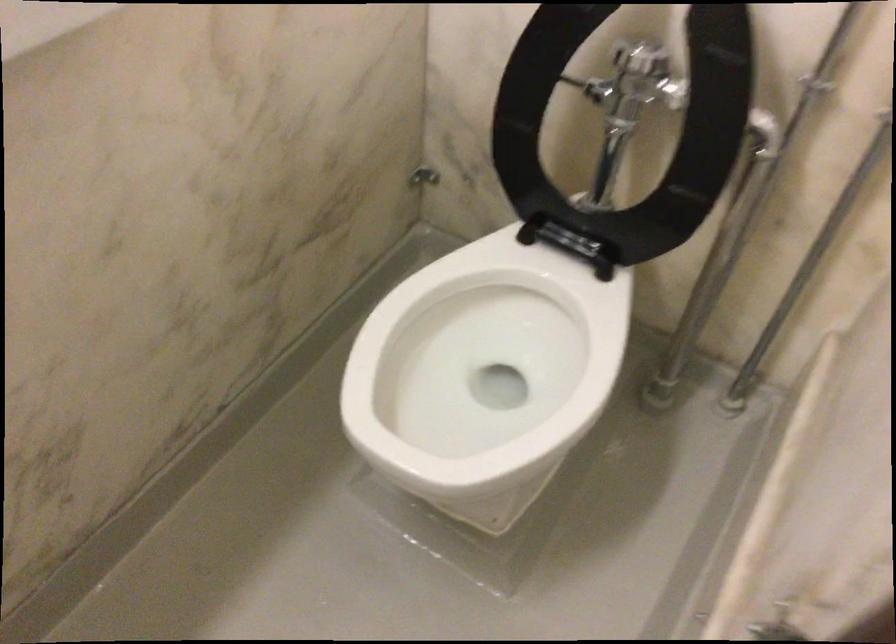
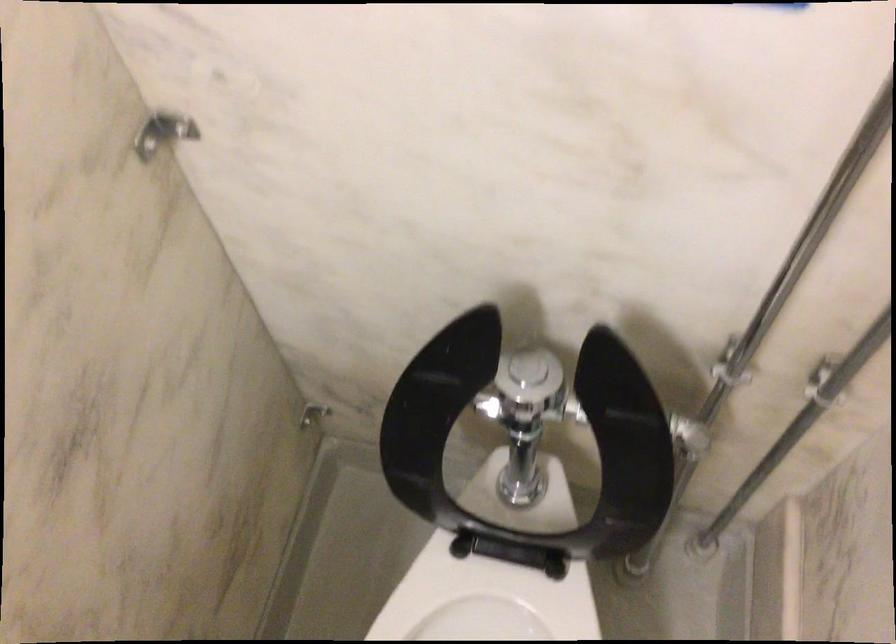
In a continuous first-person perspective shot, in which direction is the camera moving?

The cameraman moved toward right, forward.